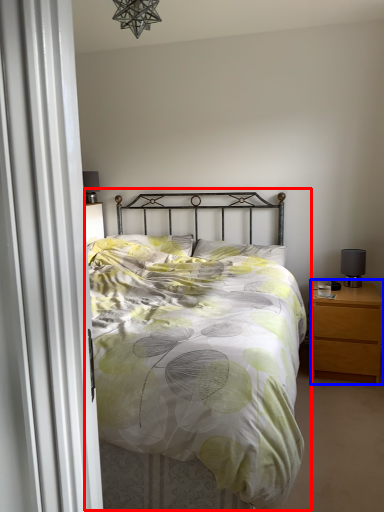
Question: Which object is closer to the camera taking this photo, bed (highlighted by a red box) or nightstand (highlighted by a blue box)?

Choices:
 (A) bed
 (B) nightstand

Answer: (A)